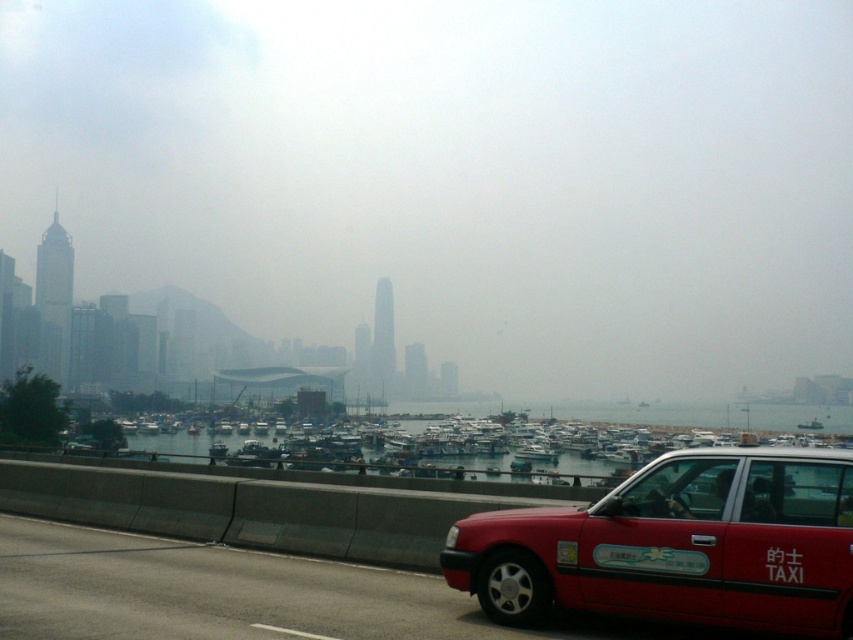
You are a photographer trying to capture the matte red taxi at lower right and the foggy haze at center in the same frame. Based on their positions, which object would appear closer to the camera in the photo?

The matte red taxi at lower right appears closer to the camera than the foggy haze at center because the haze is further away from the viewer.

You are a photographer trying to capture the matte red taxi at lower right in your shot. However, there is a foggy haze at center obstructing the view. Can you estimate whether the haze is larger or smaller than the taxi in the frame?

The foggy haze at center is bigger than the matte red taxi at lower right, so the haze is larger than the taxi in the frame.